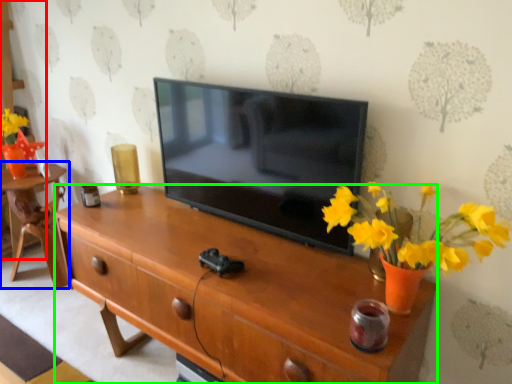
Question: Based on their relative distances, which object is farther from cabinetry (highlighted by a red box)? Choose from table (highlighted by a blue box) and desk (highlighted by a green box).

Choices:
 (A) table
 (B) desk

Answer: (B)